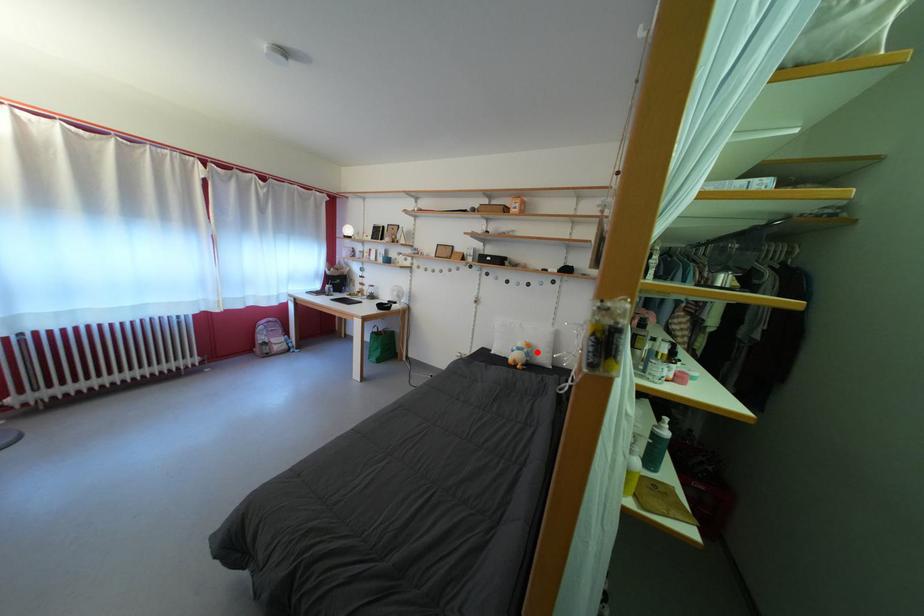
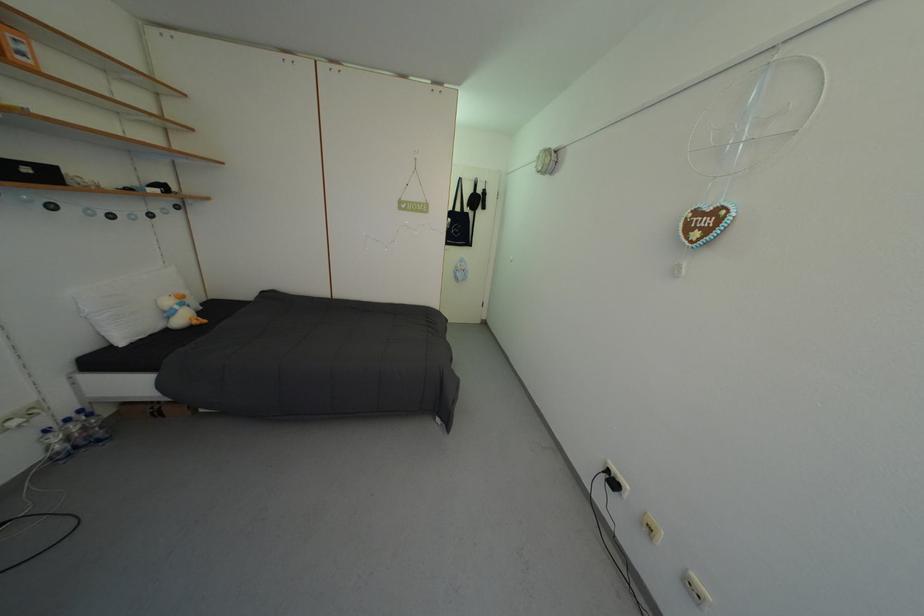
Question: I am providing you with two images of the same scene from different viewpoints. A red point is marked on the first image. Can you still see the location of the red point in image 2?

Choices:
 (A) Yes
 (B) No

Answer: (A)